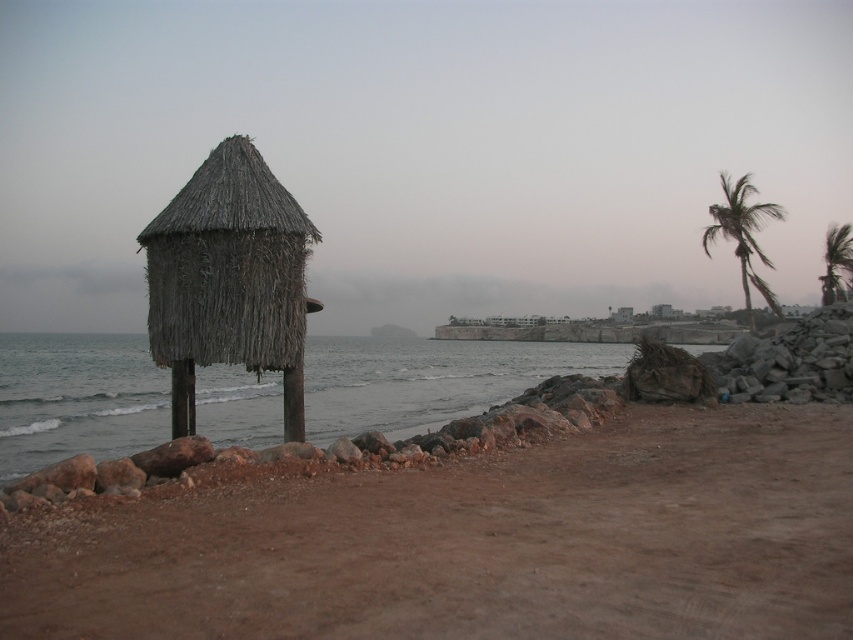
Looking at this image, which is above, thatched straw hut at left or green leafy palm tree at upper right?

green leafy palm tree at upper right is higher up.

Does thatched straw hut at left appear on the right side of green leafy palm tree at upper right?

→ No, thatched straw hut at left is not to the right of green leafy palm tree at upper right.

Does point (236, 284) come in front of point (825, 300)?

Yes, point (236, 284) is closer to viewer.

I want to click on thatched straw hut at left, so click(x=229, y=280).

Does brown sandy beach at lower left appear on the left side of gray water at center?

In fact, brown sandy beach at lower left is to the right of gray water at center.

Can you confirm if brown sandy beach at lower left is taller than gray water at center?

Incorrect, brown sandy beach at lower left's height is not larger of gray water at center's.

Is point (480, 540) closer to viewer compared to point (74, 358)?

That is True.

Locate an element on the screen. The height and width of the screenshot is (640, 853). brown sandy beach at lower left is located at coordinates (480, 545).

Can you confirm if brown sandy beach at lower left is positioned below green leafy palm tree at right?

Yes, brown sandy beach at lower left is below green leafy palm tree at right.

Who is shorter, brown sandy beach at lower left or green leafy palm tree at right?

Standing shorter between the two is brown sandy beach at lower left.

Consider the image. Measure the distance between brown sandy beach at lower left and camera.

brown sandy beach at lower left is 14.55 feet from camera.

Image resolution: width=853 pixels, height=640 pixels. What are the coordinates of `brown sandy beach at lower left` in the screenshot? It's located at (480, 545).